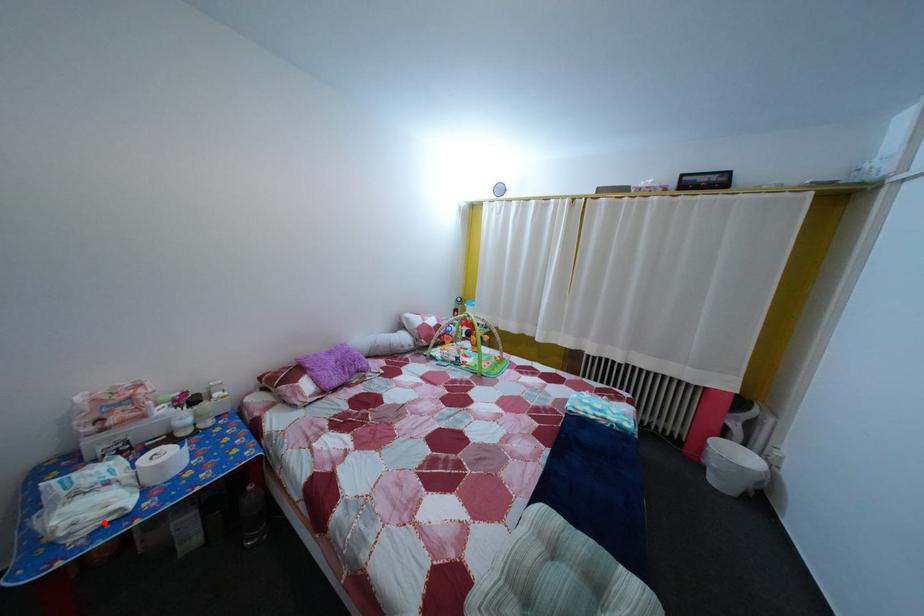
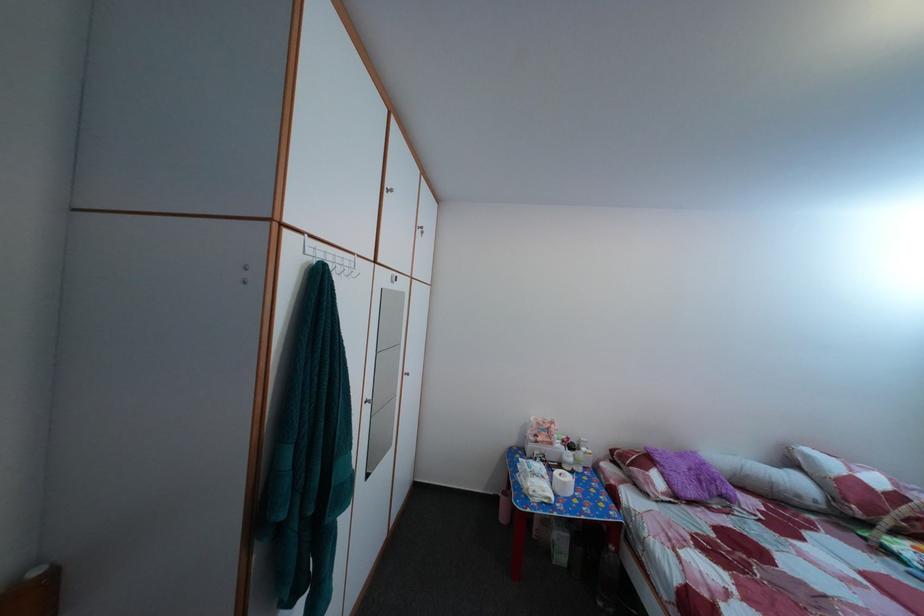
The point at the highlighted location is marked in the first image. Where is the corresponding point in the second image?

(551, 500)